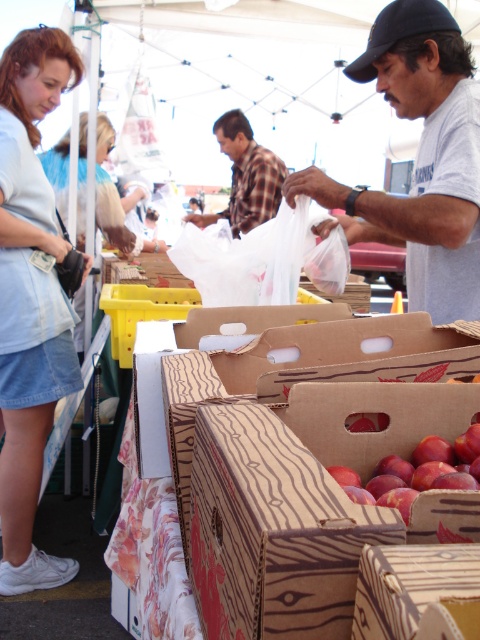
Is point (238, 173) closer to camera compared to point (408, 10)?

That is False.

Is plaid fabric shirt at center bigger than black fabric baseball cap at upper right?

Yes, plaid fabric shirt at center is bigger than black fabric baseball cap at upper right.

Who is more distant from viewer, (240, 208) or (364, 81)?

The point (240, 208) is behind.

The image size is (480, 640). I want to click on plaid fabric shirt at center, so point(245,177).

Between light blue denim skirt at lower left and black fabric baseball cap at upper right, which one is positioned lower?

Positioned lower is light blue denim skirt at lower left.

Is point (56, 296) positioned before point (416, 4)?

That is False.

Does point (33, 365) come behind point (381, 20)?

Yes.

At what (x,y) coordinates should I click in order to perform the action: click on light blue denim skirt at lower left. Please return your answer as a coordinate pair (x, y). This screenshot has width=480, height=640. Looking at the image, I should click on (31, 300).

Who is shorter, wooden crate of apples at center or plaid fabric shirt at center?

Standing shorter between the two is wooden crate of apples at center.

Is wooden crate of apples at center positioned behind plaid fabric shirt at center?

No, it is not.

The image size is (480, 640). Find the location of `wooden crate of apples at center`. wooden crate of apples at center is located at coordinates (284, 529).